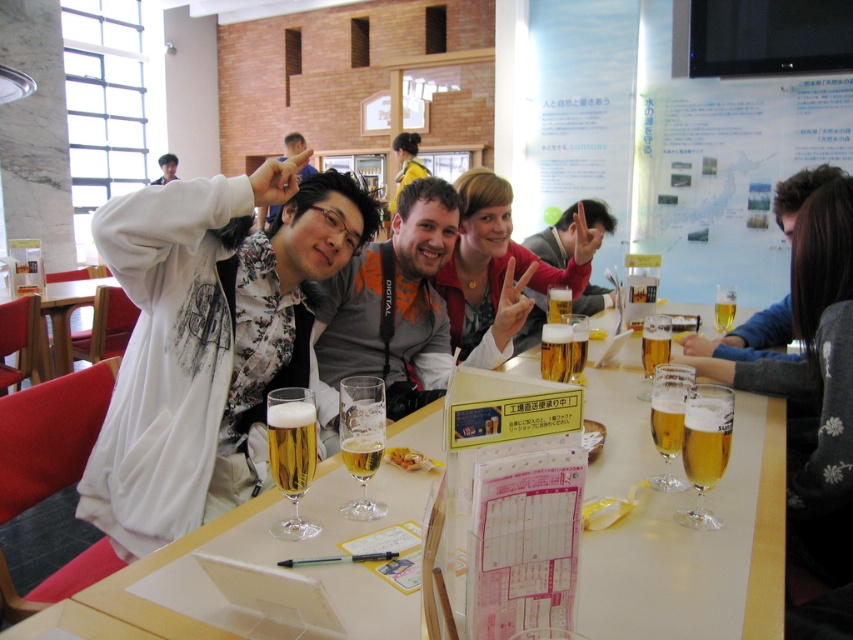
Does point (485, 324) lie behind point (555, 298)?

That is True.

Is matte white jacket at center bigger than golden glass beer at center?

Yes, matte white jacket at center is bigger than golden glass beer at center.

Describe the element at coordinates (498, 260) in the screenshot. I see `matte white jacket at center` at that location.

Find the location of a particular element. matte white jacket at center is located at coordinates (498, 260).

Who is more distant from viewer, (57, 372) or (556, 298)?

Positioned behind is point (57, 372).

Does wooden table at center have a lesser width compared to golden glass beer at center?

No.

Find the location of a particular element. wooden table at center is located at coordinates (62, 321).

Which is below, matte gray sweater at center or wooden table at center?

wooden table at center is below.

Between matte gray sweater at center and wooden table at center, which one is positioned higher?

Positioned higher is matte gray sweater at center.

Between point (581, 298) and point (45, 332), which one is positioned behind?

Positioned behind is point (45, 332).

Identify the location of matte gray sweater at center. This screenshot has height=640, width=853. (554, 241).